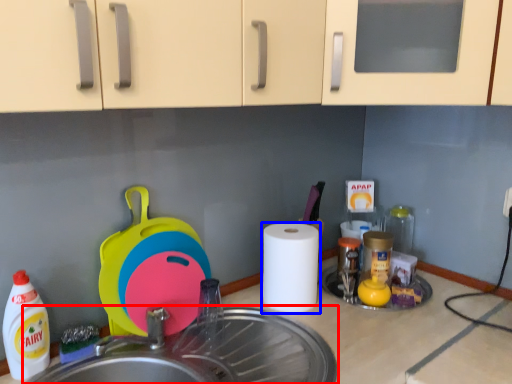
Question: Among these objects, which one is nearest to the camera, sink (highlighted by a red box) or paper towel (highlighted by a blue box)?

Choices:
 (A) sink
 (B) paper towel

Answer: (A)